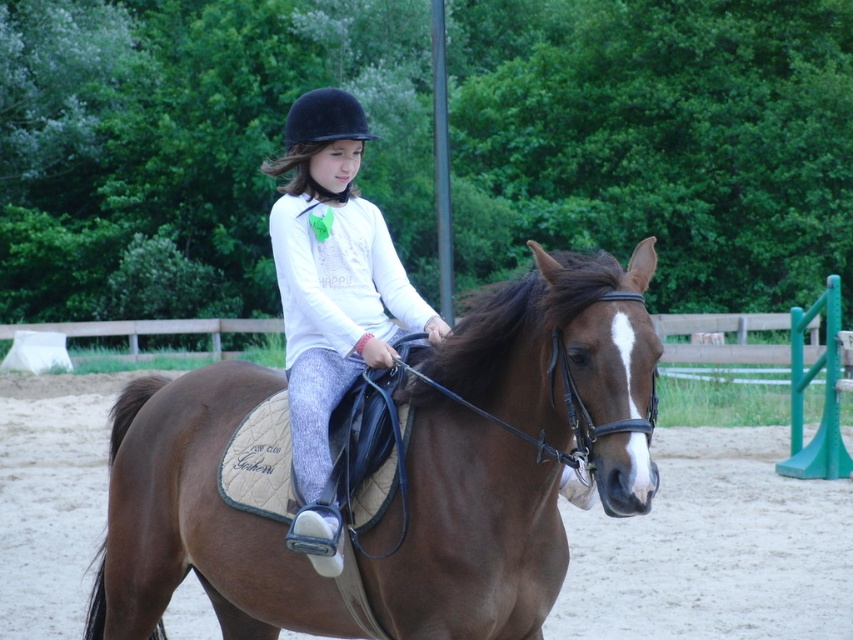
Who is positioned more to the left, white matte shirt at center or black velvet helmet at center?

From the viewer's perspective, black velvet helmet at center appears more on the left side.

Which is below, white matte shirt at center or black velvet helmet at center?

white matte shirt at center is below.

Does point (338, 88) lie behind point (314, 125)?

Yes, it is behind point (314, 125).

Locate an element on the screen. This screenshot has width=853, height=640. white matte shirt at center is located at coordinates (332, 294).

Is brown leather saddle at center bigger than white matte shirt at center?

No.

Is point (248, 403) more distant than point (311, 205)?

No, it is not.

The width and height of the screenshot is (853, 640). Identify the location of brown leather saddle at center. (196, 518).

Does brown leather saddle at center appear on the right side of black velvet helmet at center?

Indeed, brown leather saddle at center is positioned on the right side of black velvet helmet at center.

Who is positioned more to the left, brown leather saddle at center or black velvet helmet at center?

From the viewer's perspective, black velvet helmet at center appears more on the left side.

Where is `brown leather saddle at center`? brown leather saddle at center is located at coordinates (196, 518).

Identify the location of brown leather saddle at center. The image size is (853, 640). (x=196, y=518).